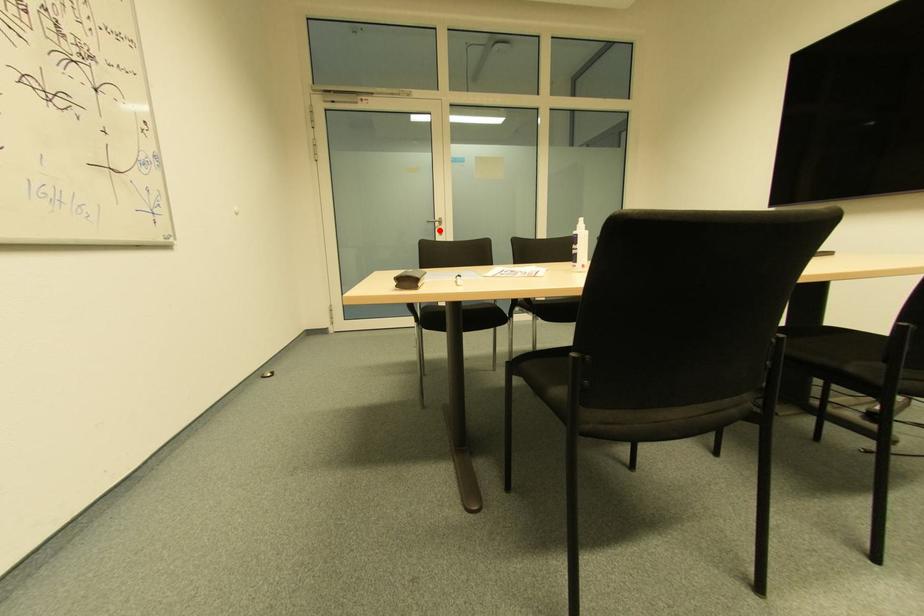
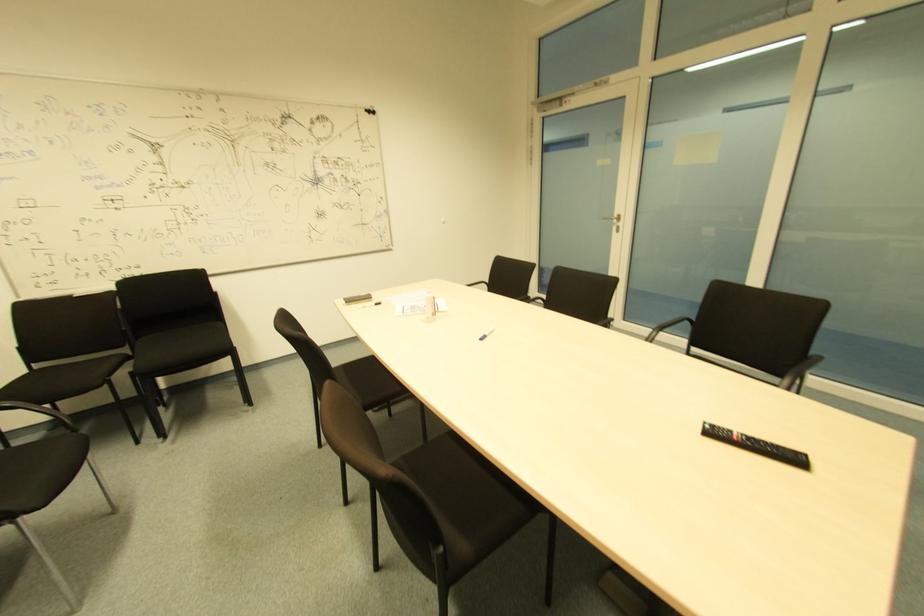
Find the pixel in the second image that matches the highlighted location in the first image.

(618, 227)